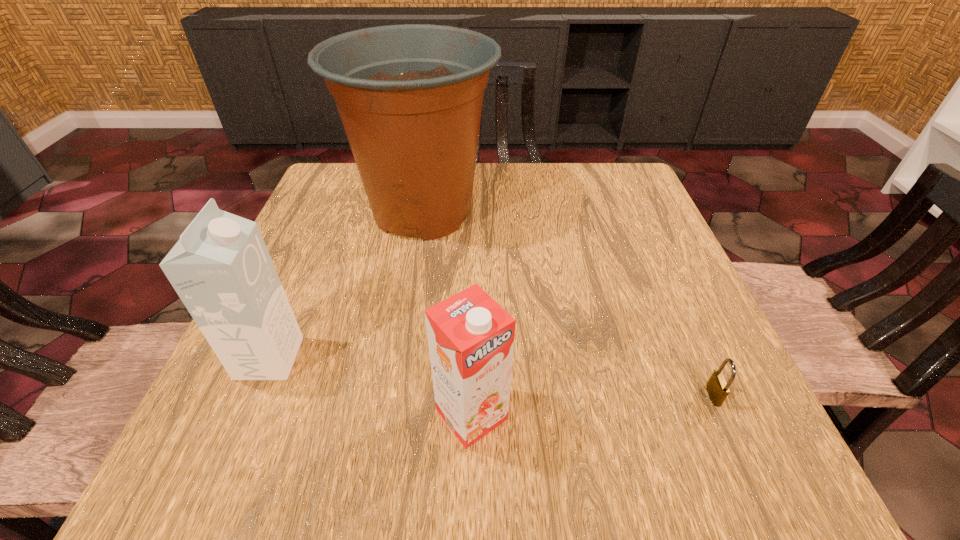
Locate which object is the second closest to the right carton. Please provide its 2D coordinates. Your answer should be formatted as a tuple, i.e. [(x, y)], where the tuple contains the x and y coordinates of a point satisfying the conditions above.

[(410, 96)]

The width and height of the screenshot is (960, 540). I want to click on object that is the second closest one to the shortest object, so click(x=410, y=96).

The image size is (960, 540). Find the location of `free space in the image that satisfies the following two spatial constraints: 1. on the back side of the rightmost object; 2. on the front label of the farther carton`. free space in the image that satisfies the following two spatial constraints: 1. on the back side of the rightmost object; 2. on the front label of the farther carton is located at coordinates (697, 358).

Where is `vacant position in the image that satisfies the following two spatial constraints: 1. on the back side of the rightmost object; 2. on the right side of the second shortest object`? vacant position in the image that satisfies the following two spatial constraints: 1. on the back side of the rightmost object; 2. on the right side of the second shortest object is located at coordinates (472, 395).

You are a GUI agent. You are given a task and a screenshot of the screen. Output one action in this format:
    pyautogui.click(x=<x>, y=<y>)
    Task: Click on the vacant space that satisfies the following two spatial constraints: 1. on the front side of the farthest object; 2. on the front label of the left carton
    
    Given the screenshot: What is the action you would take?
    pyautogui.click(x=398, y=358)

At what (x,y) coordinates should I click in order to perform the action: click on free location that satisfies the following two spatial constraints: 1. on the front label of the rightmost object; 2. on the left side of the taller carton. Please return your answer as a coordinate pair (x, y). The image size is (960, 540). Looking at the image, I should click on (253, 395).

Identify the location of free point that satisfies the following two spatial constraints: 1. on the back side of the nearer carton; 2. on the front label of the second farthest object. (472, 358).

Find the location of `vacant area in the image that satisfies the following two spatial constraints: 1. on the front side of the padlock; 2. on the right side of the flowerpot`. vacant area in the image that satisfies the following two spatial constraints: 1. on the front side of the padlock; 2. on the right side of the flowerpot is located at coordinates (393, 395).

Image resolution: width=960 pixels, height=540 pixels. In order to click on free region that satisfies the following two spatial constraints: 1. on the front label of the taller carton; 2. on the back side of the padlock in this screenshot , I will do `click(253, 395)`.

Where is `vacant region that satisfies the following two spatial constraints: 1. on the front side of the farthest object; 2. on the left side of the padlock`? vacant region that satisfies the following two spatial constraints: 1. on the front side of the farthest object; 2. on the left side of the padlock is located at coordinates (393, 395).